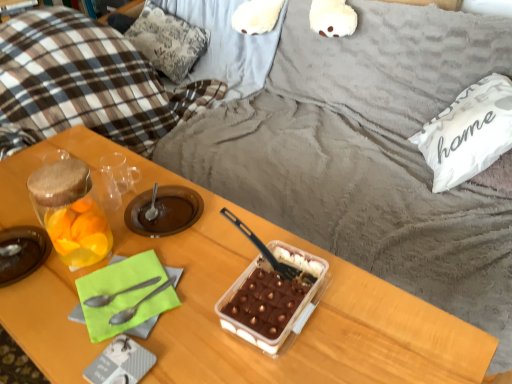
What are the coordinates of `free space to the left of silver metallic spoon at center, acting as the 2th spoon starting from the right` in the screenshot? It's located at (65, 302).